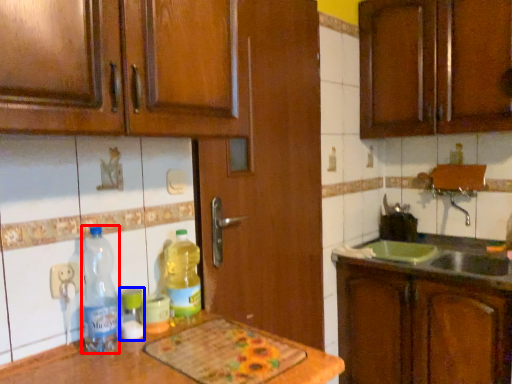
Question: Which object appears closest to the camera in this image, bottle (highlighted by a red box) or bottle (highlighted by a blue box)?

Choices:
 (A) bottle
 (B) bottle

Answer: (A)